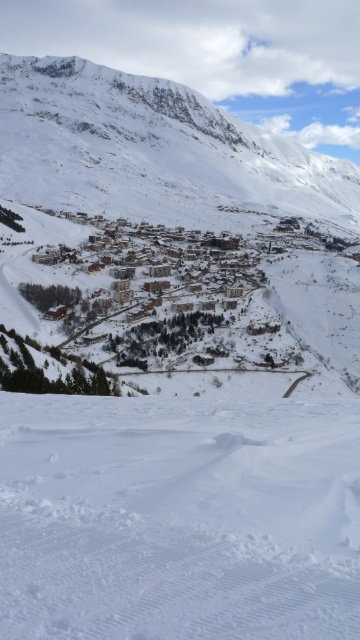
Question: Which object is farther from the camera taking this photo?

Choices:
 (A) white powdery snow at lower center
 (B) white snow-covered mountain at center

Answer: (B)

Question: Can you confirm if white powdery snow at lower center is positioned above white snow-covered mountain at center?

Choices:
 (A) yes
 (B) no

Answer: (B)

Question: From the image, what is the correct spatial relationship of white powdery snow at lower center in relation to white snow-covered mountain at center?

Choices:
 (A) right
 (B) left

Answer: (A)

Question: Observing the image, what is the correct spatial positioning of white powdery snow at lower center in reference to white snow-covered mountain at center?

Choices:
 (A) right
 (B) left

Answer: (A)

Question: Among these objects, which one is nearest to the camera?

Choices:
 (A) white snow-covered mountain at center
 (B) white powdery snow at lower center

Answer: (B)